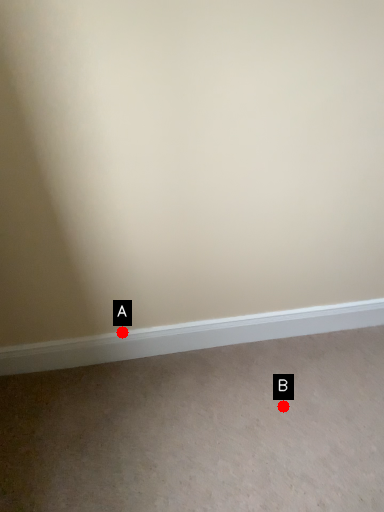
Question: Two points are circled on the image, labeled by A and B beside each circle. Among these points, which one is farthest from the camera?

Choices:
 (A) A is further
 (B) B is further

Answer: (A)